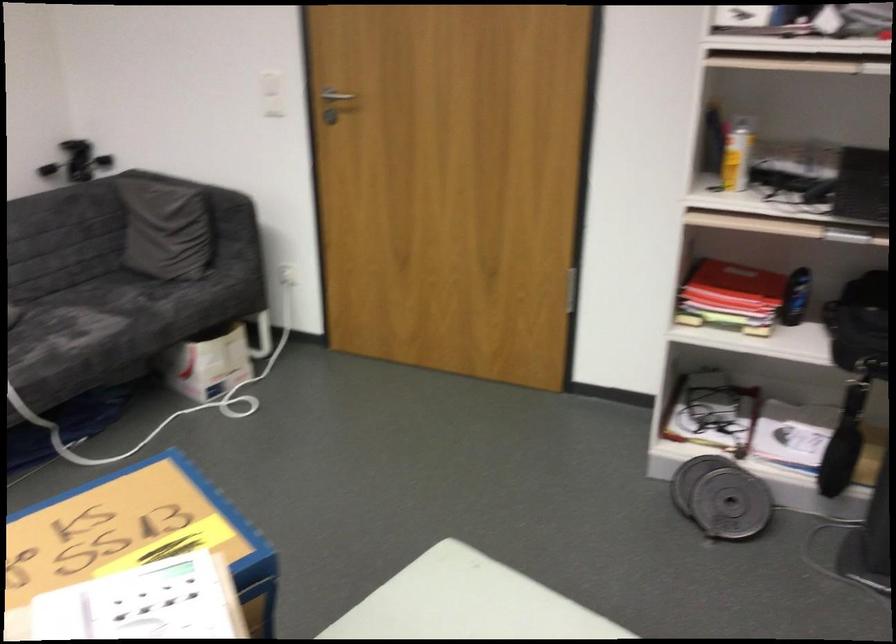
Find where to sit the sofa sitting surface. Please return your answer as a coordinate pair (x, y).

(156, 306)